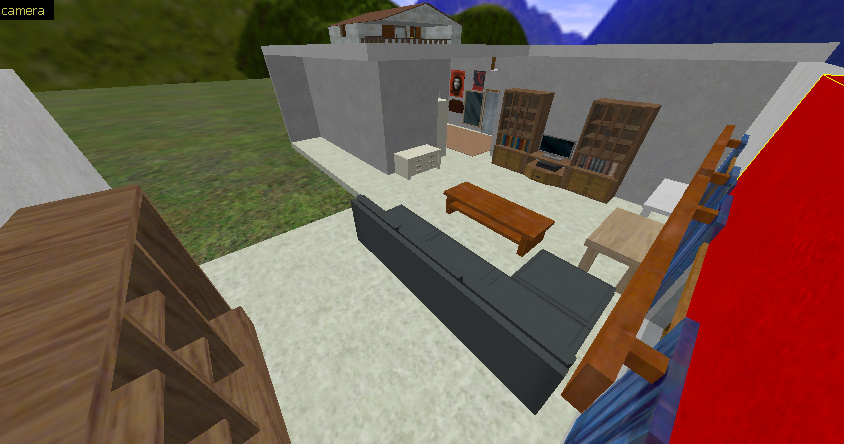
In order to click on couch in this screenshot , I will do `click(515, 299)`.